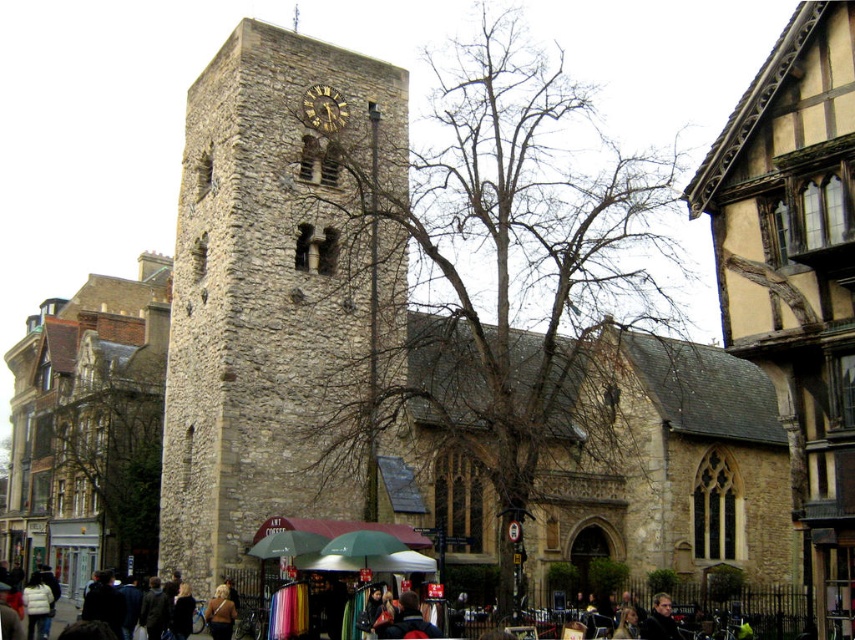
Question: Can you confirm if wooden half-timbered building at right is thinner than stone tower at center?

Choices:
 (A) yes
 (B) no

Answer: (A)

Question: Which point is farther to the camera?

Choices:
 (A) (358, 243)
 (B) (789, 300)

Answer: (A)

Question: Which point is closer to the camera?

Choices:
 (A) golden hair at lower center
 (B) wooden half-timbered building at right
 (C) stone tower at center
 (D) gray stone tower at center

Answer: (B)

Question: Is wooden half-timbered building at right below golden hair at lower center?

Choices:
 (A) no
 (B) yes

Answer: (A)

Question: Is gray stone tower at center to the right of golden hair at lower center from the viewer's perspective?

Choices:
 (A) yes
 (B) no

Answer: (A)

Question: Which point is farther to the camera?

Choices:
 (A) (230, 628)
 (B) (228, 204)
 (C) (93, 406)

Answer: (C)